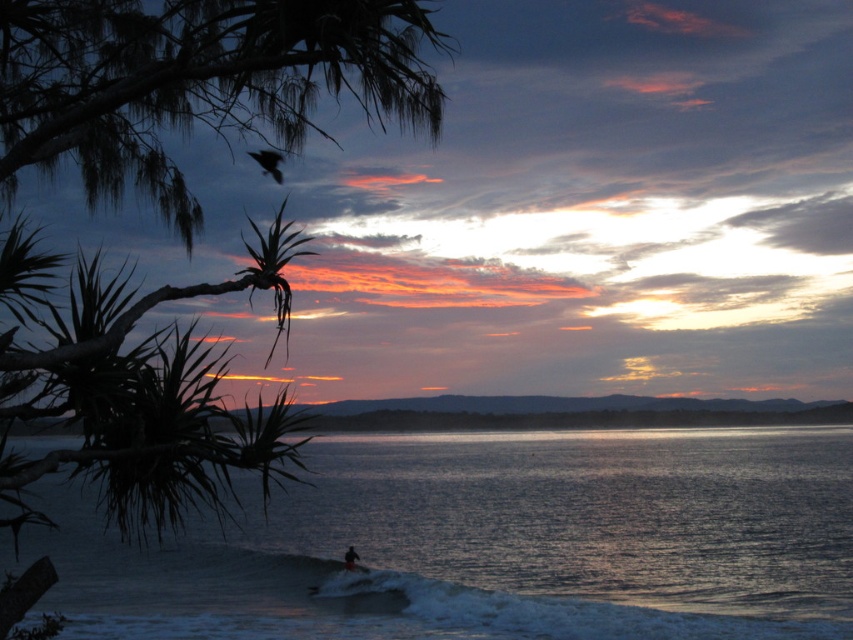
Consider the image. Can you confirm if green leafy tree at upper left is positioned to the left of white foam surfboard at lower center?

Correct, you'll find green leafy tree at upper left to the left of white foam surfboard at lower center.

Looking at this image, is green leafy tree at upper left wider than white foam surfboard at lower center?

Yes.

Which is in front, point (280, 70) or point (368, 572)?

Point (280, 70) is in front.

Identify the location of green leafy tree at upper left. This screenshot has height=640, width=853. (196, 81).

Is black matte surfboard at lower center thinner than white foam surfboard at lower center?

Yes.

The width and height of the screenshot is (853, 640). I want to click on black matte surfboard at lower center, so click(350, 557).

Between point (345, 552) and point (344, 561), which one is positioned in front?

Point (344, 561) is more forward.

Identify the location of black matte surfboard at lower center. The width and height of the screenshot is (853, 640). (350, 557).

Is clear water at center further to camera compared to black matte surfboard at lower center?

No, clear water at center is in front of black matte surfboard at lower center.

Who is more distant from viewer, [657,586] or [355,561]?

Positioned behind is point [355,561].

Locate an element on the screen. The width and height of the screenshot is (853, 640). clear water at center is located at coordinates (497, 541).